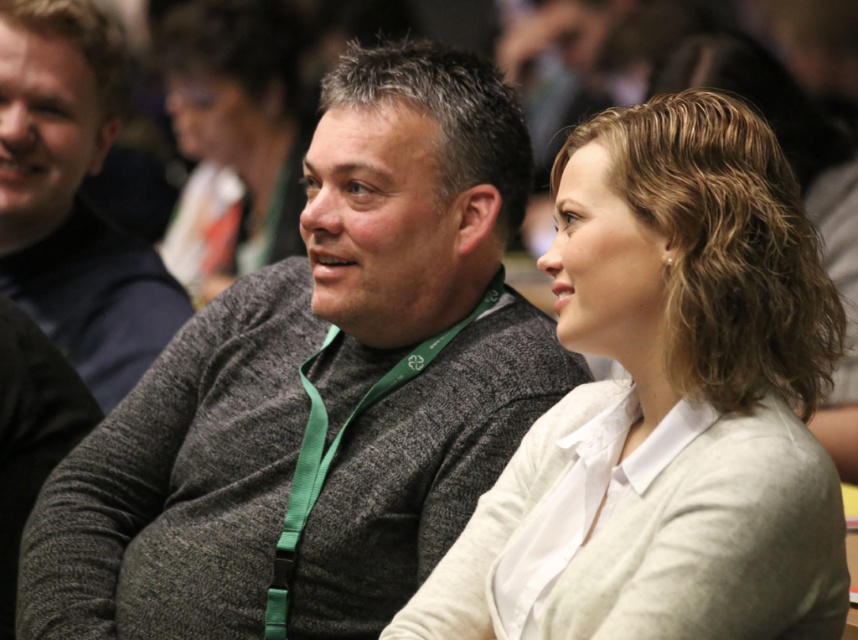
Is gray knit sweater at center smaller than matte black hair at upper center?

No.

Which is in front, point (103, 468) or point (260, 211)?

Positioned in front is point (103, 468).

Who is more distant from viewer, (206, 634) or (189, 76)?

The point (189, 76) is more distant.

Identify the location of gray knit sweater at center. Image resolution: width=858 pixels, height=640 pixels. (319, 387).

Between gray knit sweater at center and light beige sweater at center, which one is positioned lower?

Positioned lower is gray knit sweater at center.

Can you confirm if gray knit sweater at center is positioned above light beige sweater at center?

Actually, gray knit sweater at center is below light beige sweater at center.

This screenshot has height=640, width=858. What do you see at coordinates (319, 387) in the screenshot? I see `gray knit sweater at center` at bounding box center [319, 387].

This screenshot has width=858, height=640. What are the coordinates of `gray knit sweater at center` in the screenshot? It's located at (319, 387).

Which is more to the right, light beige sweater at center or dark gray sweater at center?

light beige sweater at center

Is light beige sweater at center wider than dark gray sweater at center?

Yes.

Where is `light beige sweater at center`? This screenshot has width=858, height=640. light beige sweater at center is located at coordinates (668, 404).